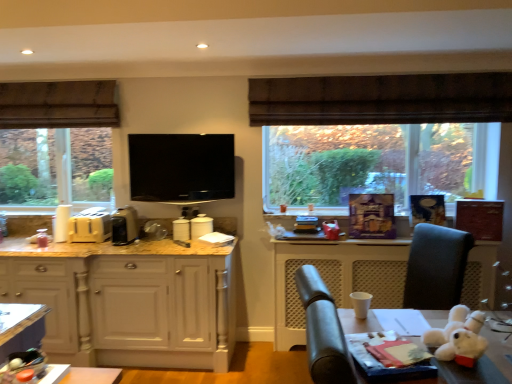
At what (x,y) coordinates should I click in order to perform the action: click on vacant area situated below metallic silver coffee machine at left, acting as the second appliance starting from the left (from a real-world perspective). Please return your answer as a coordinate pair (x, y). This screenshot has height=384, width=512. Looking at the image, I should click on (125, 242).